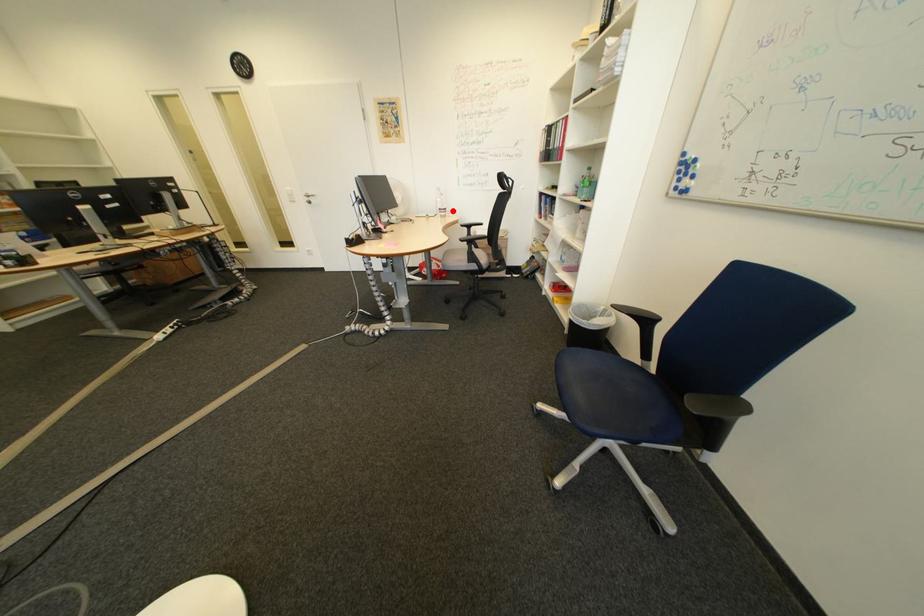
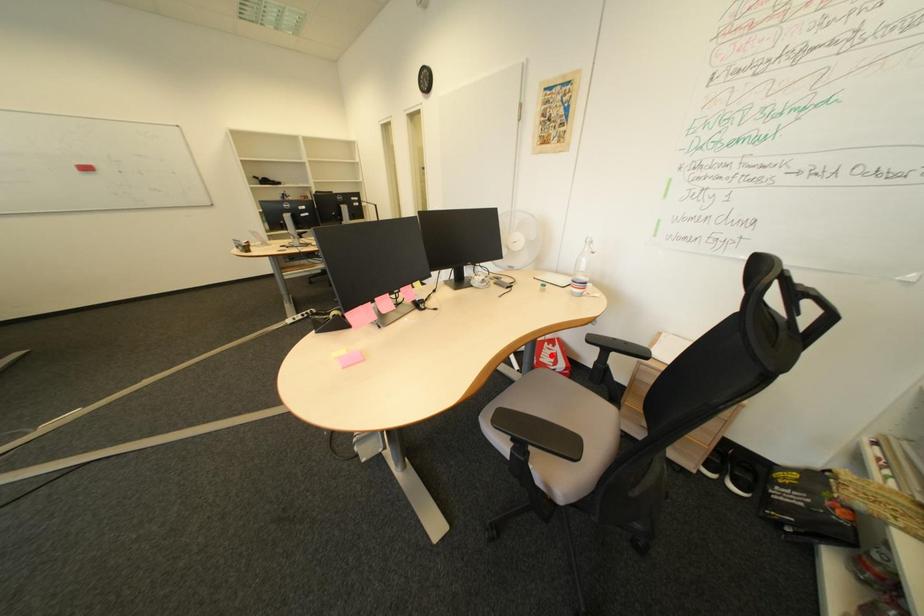
Looking at this image, I am providing you with two images of the same scene from different viewpoints. A red point is marked on the first image and another point is marked on the second image. Are the points marked in image1 and image2 representing the same 3D position?

No